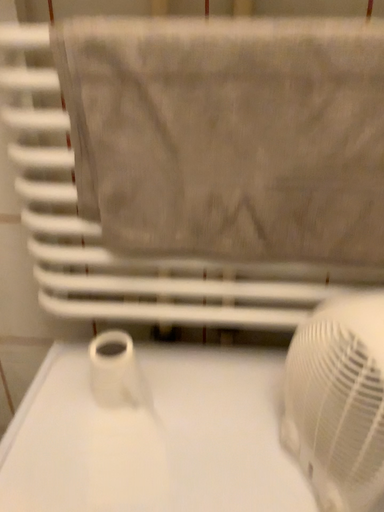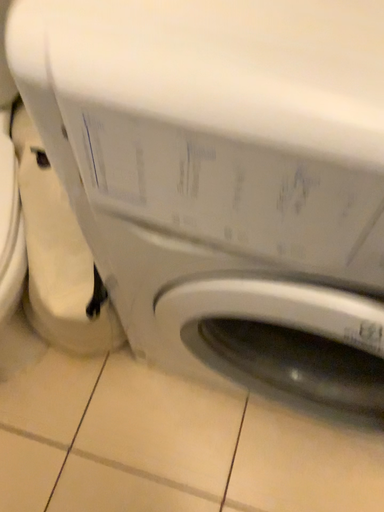
Question: How did the camera likely rotate when shooting the video?

Choices:
 (A) rotated downward
 (B) rotated upward

Answer: (A)